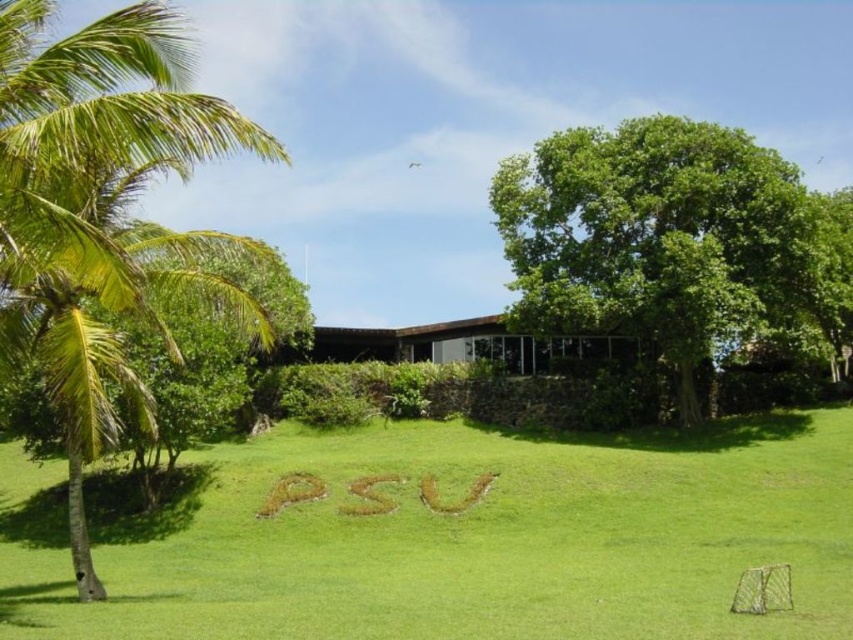
Is green leafy palm tree at left thinner than green leafy tree at upper right?

Yes.

In the scene shown: Which of these two, green leafy palm tree at left or green leafy tree at upper right, stands taller?

green leafy tree at upper right is taller.

Which is behind, point (129, 292) or point (680, 340)?

Positioned behind is point (680, 340).

In order to click on green leafy palm tree at left in this screenshot , I will do `click(100, 212)`.

Consider the image. Is green grass at center to the right of green leafy tree at upper right from the viewer's perspective?

Answer: No, green grass at center is not to the right of green leafy tree at upper right.

Locate an element on the screen. This screenshot has width=853, height=640. green grass at center is located at coordinates (474, 541).

Is green grass at center bigger than green leafy palm tree at left?

Actually, green grass at center might be smaller than green leafy palm tree at left.

What do you see at coordinates (474, 541) in the screenshot? I see `green grass at center` at bounding box center [474, 541].

Does point (381, 589) come farther from viewer compared to point (230, 138)?

Yes, it is behind point (230, 138).

Locate an element on the screen. The width and height of the screenshot is (853, 640). green grass at center is located at coordinates (474, 541).